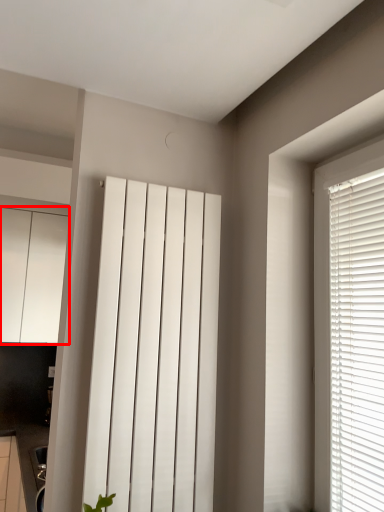
Question: From the image's perspective, what is the correct spatial positioning of cabinetry (annotated by the red box) in reference to curtain?

Choices:
 (A) below
 (B) above

Answer: (B)